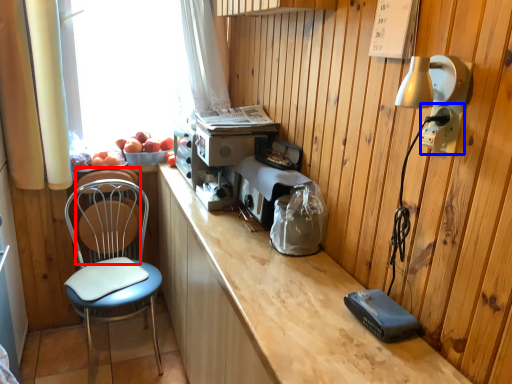
Question: Which object is closer to the camera taking this photo, armchair (highlighted by a red box) or electric outlet (highlighted by a blue box)?

Choices:
 (A) armchair
 (B) electric outlet

Answer: (B)